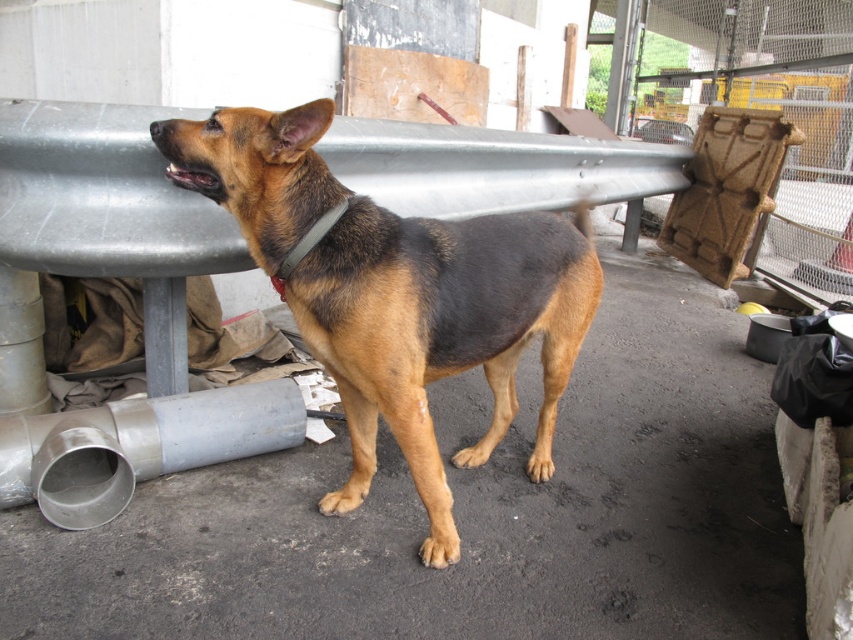
Question: Which point is farther from the camera taking this photo?

Choices:
 (A) (310, 237)
 (B) (496, 312)
 (C) (7, 484)

Answer: (C)

Question: Which point is farther from the camera taking this photo?

Choices:
 (A) (283, 280)
 (B) (57, 522)
 (C) (448, 266)

Answer: (B)

Question: Is brown fur dog at center thinner than black leather neckband at center?

Choices:
 (A) yes
 (B) no

Answer: (B)

Question: Among these points, which one is nearest to the camera?

Choices:
 (A) (54, 492)
 (B) (560, 289)
 (C) (346, 205)

Answer: (C)

Question: Does brown fur dog at center appear on the left side of black leather neckband at center?

Choices:
 (A) no
 (B) yes

Answer: (A)

Question: Does silver metallic pipe at lower left appear over black leather neckband at center?

Choices:
 (A) no
 (B) yes

Answer: (A)